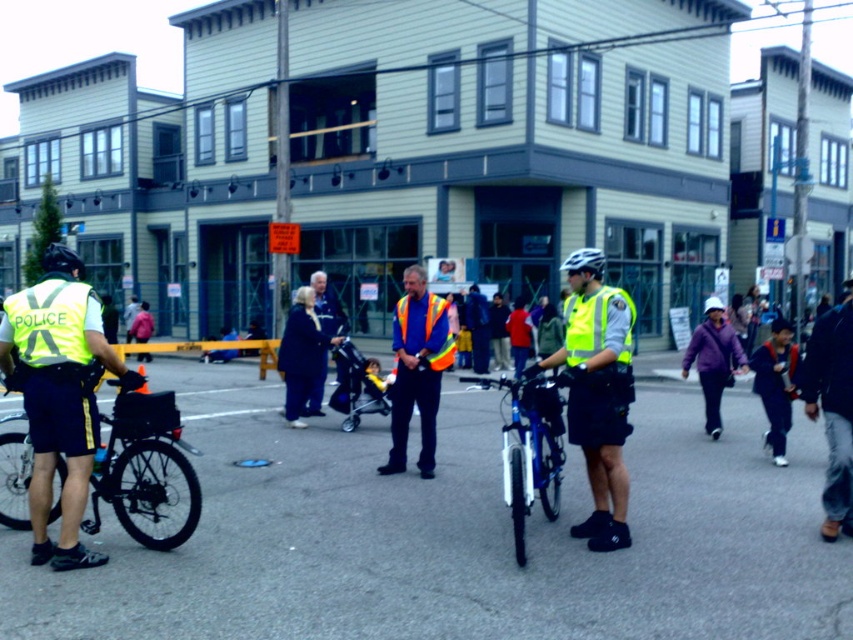
Can you confirm if reflective yellow vest at center is positioned to the right of purple fleece jacket at lower right?

No, reflective yellow vest at center is not to the right of purple fleece jacket at lower right.

Does reflective yellow vest at center lie behind purple fleece jacket at lower right?

No, reflective yellow vest at center is in front of purple fleece jacket at lower right.

In the scene shown: Measure the distance between reflective yellow vest at center and camera.

reflective yellow vest at center and camera are 20.57 feet apart from each other.

Where is `reflective yellow vest at center`? The width and height of the screenshot is (853, 640). reflective yellow vest at center is located at coordinates (596, 392).

Which of these two, reflective yellow vest at center or reflective orange vest at center, stands taller?

With more height is reflective orange vest at center.

Locate an element on the screen. Image resolution: width=853 pixels, height=640 pixels. reflective yellow vest at center is located at coordinates (596, 392).

The image size is (853, 640). Describe the element at coordinates (416, 369) in the screenshot. I see `reflective orange vest at center` at that location.

Consider the image. Does reflective orange vest at center appear on the right side of dark blue fabric coat at center?

Correct, you'll find reflective orange vest at center to the right of dark blue fabric coat at center.

Is point (413, 403) positioned before point (310, 358)?

Yes, point (413, 403) is in front of point (310, 358).

This screenshot has height=640, width=853. I want to click on reflective orange vest at center, so click(x=416, y=369).